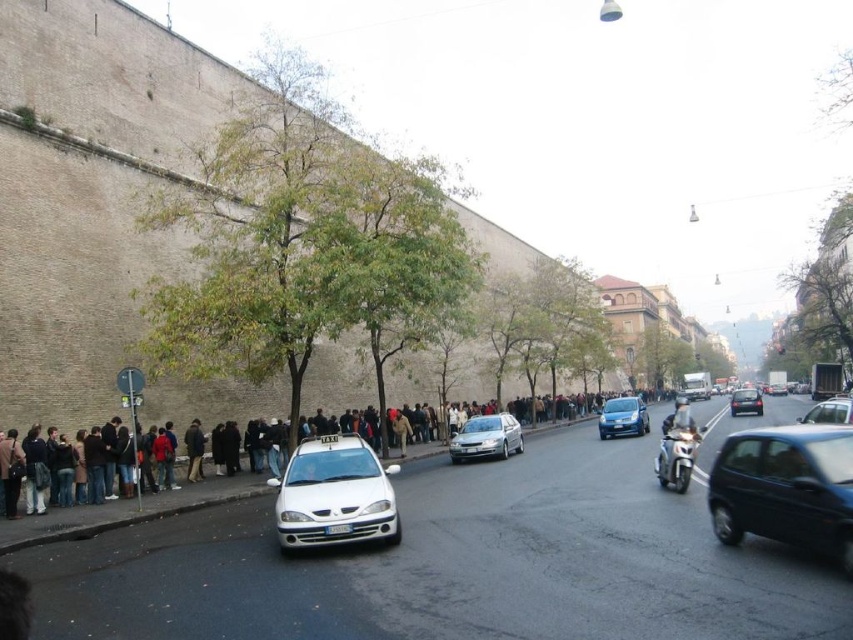
You are standing on the sidewalk in front of the aged stone wall. There is a shiny black car at center. If you want to cross the street to reach the other side, which direction should you walk along the sidewalk before crossing?

Since the shiny black car at center is positioned at point 0.764 on the x axis and 0.921 on the y axis, you should walk towards the left along the sidewalk before crossing the street to reach the other side.

You are a delivery person trying to navigate through the street scene. You need to deliver a package to the address located beyond the dark gray fabric crowd at left. Can you pass through the area near the satin silver sedan at center without getting blocked by the crowd?

The dark gray fabric crowd at left is bigger than the satin silver sedan at center, so the crowd is larger and might block the path near the sedan. It is advisable to find an alternative route to avoid obstruction.